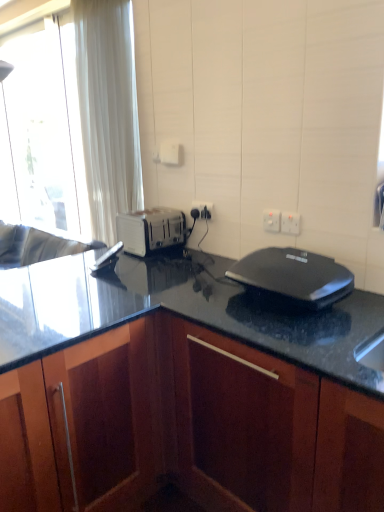
I want to click on free space to the left of black plastic sandwich maker at center, so click(x=199, y=305).